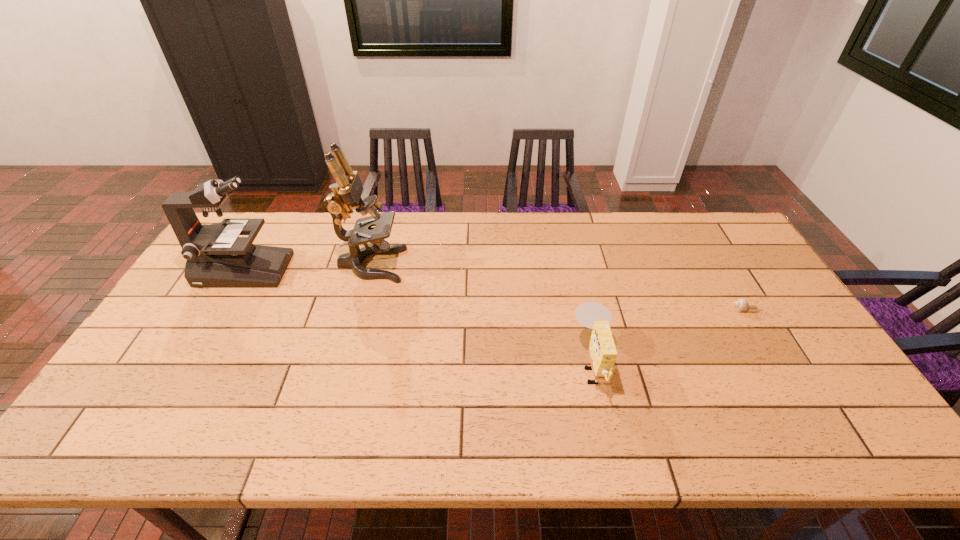
The width and height of the screenshot is (960, 540). In order to click on the taller microscope in this screenshot , I will do `click(346, 194)`.

The height and width of the screenshot is (540, 960). I want to click on the tallest object, so click(x=346, y=194).

Where is `the left microscope`? the left microscope is located at coordinates (216, 256).

This screenshot has height=540, width=960. I want to click on the second tallest object, so click(x=216, y=256).

The image size is (960, 540). Find the location of `the second object from right to left`. the second object from right to left is located at coordinates (602, 351).

Find the location of `the third tallest object`. the third tallest object is located at coordinates (602, 351).

Where is `the rightmost object`? Image resolution: width=960 pixels, height=540 pixels. the rightmost object is located at coordinates (741, 305).

Find the location of a particular element. Image resolution: width=960 pixels, height=540 pixels. the second nearest object is located at coordinates (741, 305).

Identify the location of vacant region located 0.210m at the eyepieces of the tallest object. (469, 265).

Identify the location of vacant space located through the eyepieces of the third shortest object. (412, 270).